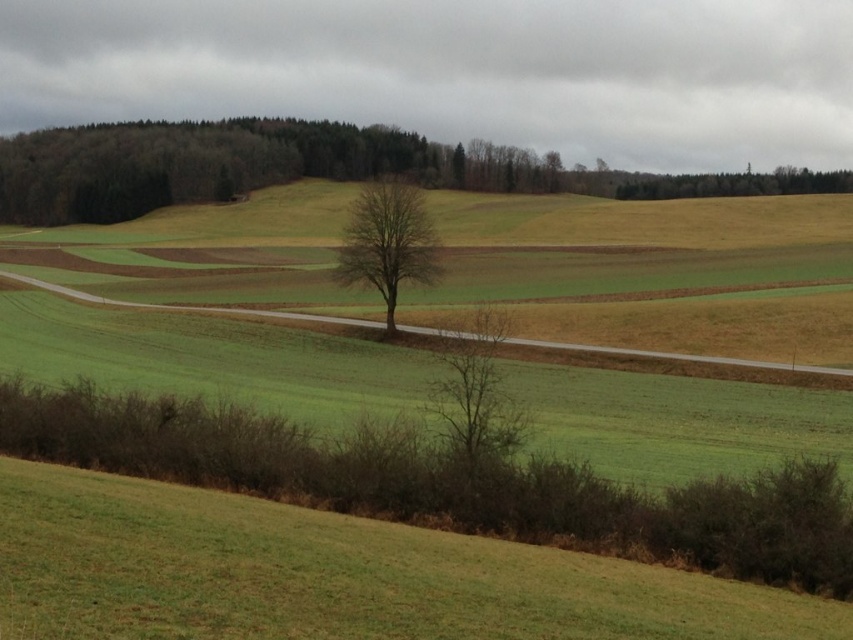
Question: Considering the relative positions of bare tree at upper center and bare branches at center in the image provided, where is bare tree at upper center located with respect to bare branches at center?

Choices:
 (A) left
 (B) right

Answer: (B)

Question: Can you confirm if green grassy at lower left is smaller than bare tree at upper center?

Choices:
 (A) no
 (B) yes

Answer: (B)

Question: Which object is closer to the camera taking this photo?

Choices:
 (A) bare tree at upper center
 (B) bare brown tree at center
 (C) bare branches at center
 (D) green leafy tree at upper right

Answer: (C)

Question: Which of these objects is positioned closest to the green grassy at lower left?

Choices:
 (A) bare brown tree at center
 (B) bare branches at center

Answer: (B)

Question: Which is nearer to the bare tree at upper center?

Choices:
 (A) bare brown tree at center
 (B) green grassy at lower left
 (C) bare branches at center
 (D) green leafy tree at upper right

Answer: (D)

Question: Does bare branches at center appear on the right side of green leafy tree at upper right?

Choices:
 (A) no
 (B) yes

Answer: (A)